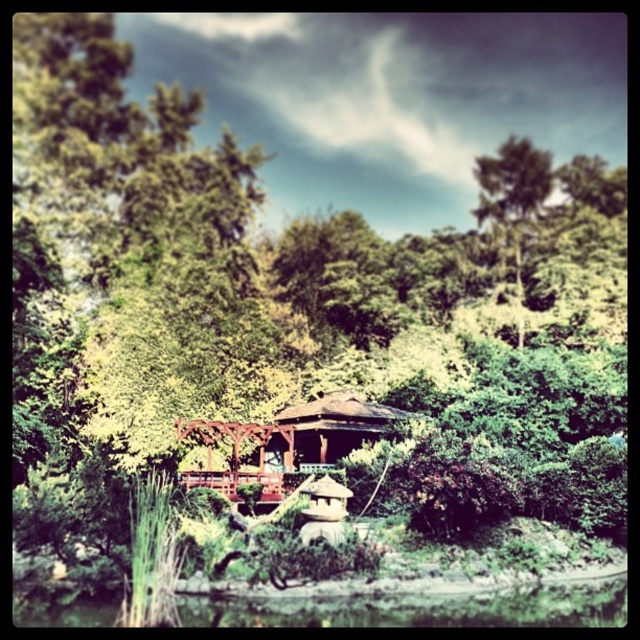
Does green grassy river at lower center have a smaller size compared to wooden gazebo at center?

Correct, green grassy river at lower center occupies less space than wooden gazebo at center.

Which is more to the left, green grassy river at lower center or wooden gazebo at center?

From the viewer's perspective, wooden gazebo at center appears more on the left side.

Who is more distant from viewer, (24, 609) or (340, 451)?

Positioned behind is point (340, 451).

At what (x,y) coordinates should I click in order to perform the action: click on green grassy river at lower center. Please return your answer as a coordinate pair (x, y). Looking at the image, I should click on (420, 609).

Is wooden gazebo at center shorter than green leafy tree at upper right?

Indeed, wooden gazebo at center has a lesser height compared to green leafy tree at upper right.

Based on the photo, does wooden gazebo at center appear under green leafy tree at upper right?

Indeed, wooden gazebo at center is positioned under green leafy tree at upper right.

Locate an element on the screen. wooden gazebo at center is located at coordinates (289, 442).

Does green grassy river at lower center lie in front of green leafy tree at upper right?

Yes.

Where is `green grassy river at lower center`? This screenshot has height=640, width=640. green grassy river at lower center is located at coordinates (420, 609).

Is point (225, 621) less distant than point (506, 160)?

Yes, it is.

Identify the location of green grassy river at lower center. This screenshot has width=640, height=640. (420, 609).